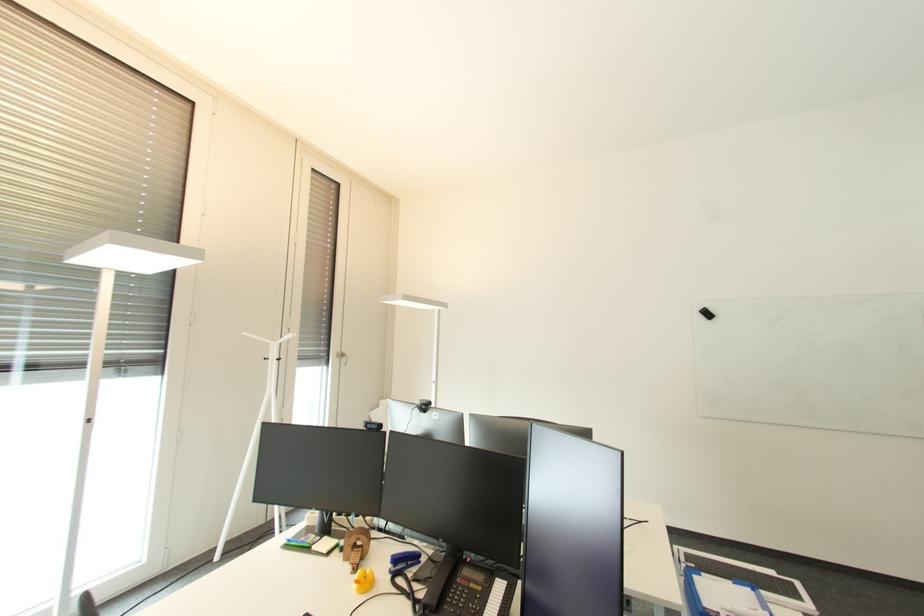
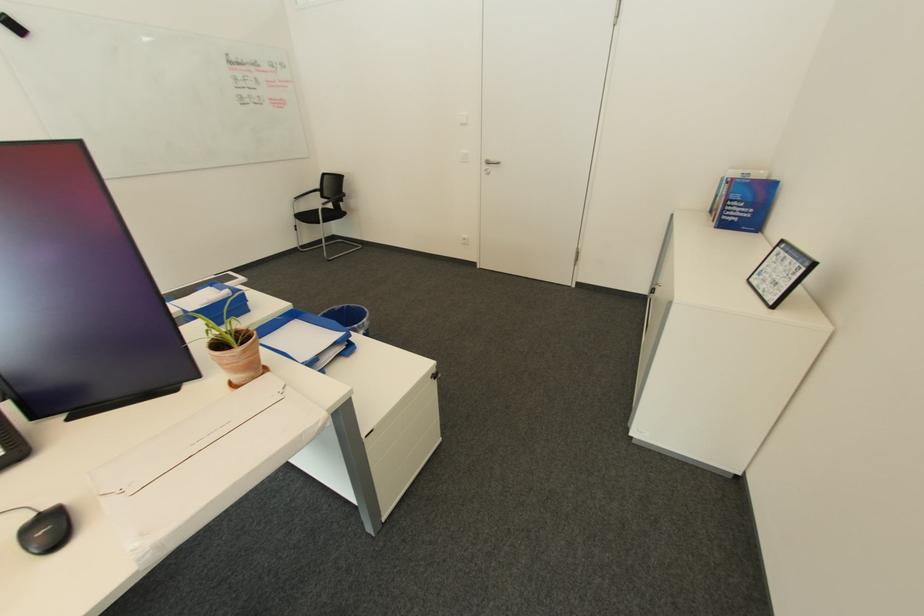
Based on the photo, based on the continuous images, in which direction is the camera rotating?

The camera rotated toward right-down.